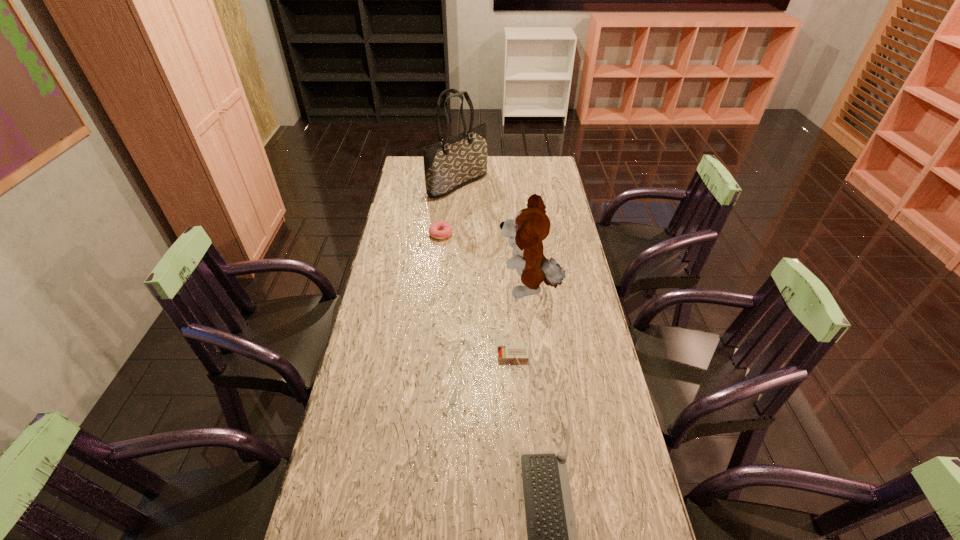
Find the location of a particular element. the tallest object is located at coordinates click(450, 164).

The height and width of the screenshot is (540, 960). Find the location of `tote bag`. tote bag is located at coordinates (450, 164).

The height and width of the screenshot is (540, 960). I want to click on puppy, so click(531, 225).

In order to click on the third farthest object in this screenshot , I will do `click(531, 225)`.

I want to click on the third tallest object, so click(434, 229).

Where is `doughnut`? doughnut is located at coordinates (434, 229).

Find the location of a particular element. This screenshot has height=540, width=960. the second shortest object is located at coordinates (505, 353).

Locate an element on the screen. Image resolution: width=960 pixels, height=540 pixels. matchbox is located at coordinates (505, 353).

The image size is (960, 540). Find the location of `free space located 0.060m on the left of the farthest object`. free space located 0.060m on the left of the farthest object is located at coordinates (416, 184).

Image resolution: width=960 pixels, height=540 pixels. Find the location of `free location located on the face of the second tallest object`. free location located on the face of the second tallest object is located at coordinates (391, 288).